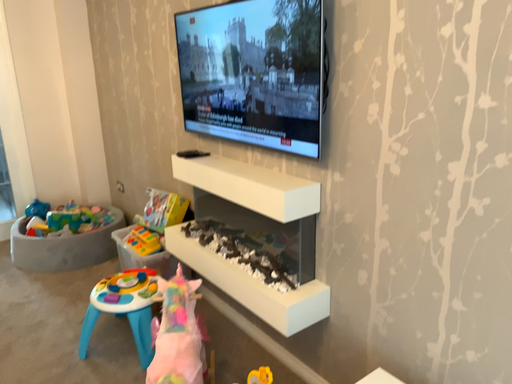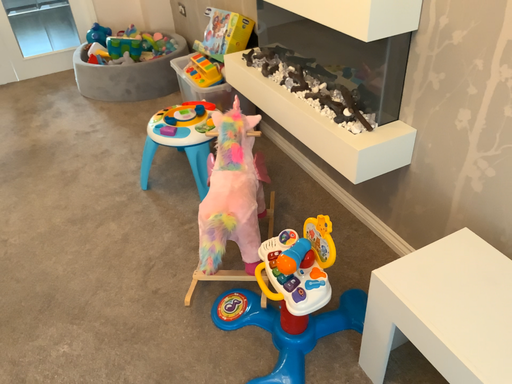
Question: How did the camera likely rotate when shooting the video?

Choices:
 (A) rotated downward
 (B) rotated upward

Answer: (A)